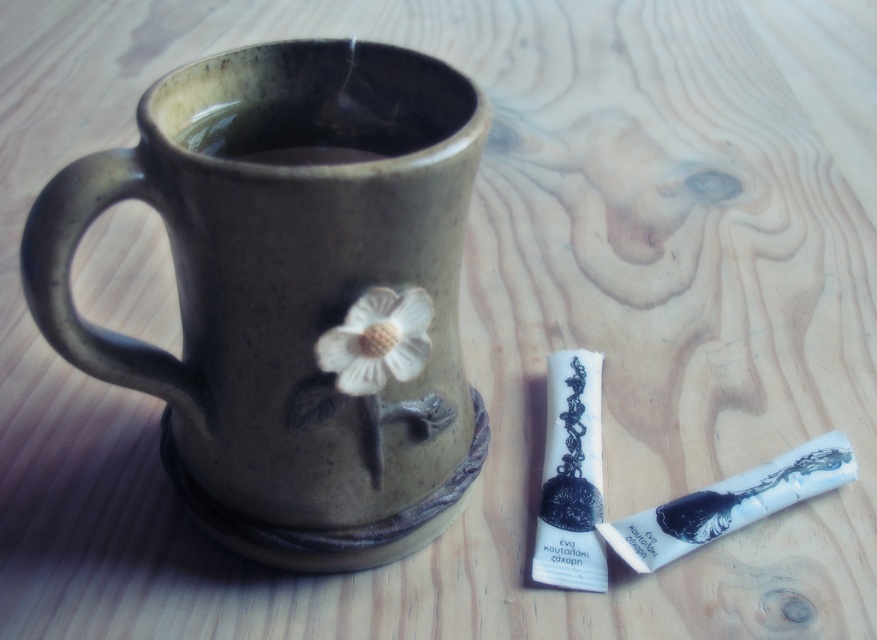
Question: Which object appears closest to the camera in this image?

Choices:
 (A) matte ceramic mug at center
 (B) white matte flower at center

Answer: (A)

Question: Which of these objects is positioned farthest from the white matte flower at center?

Choices:
 (A) matte ceramic mug at center
 (B) brown matte tea at upper center

Answer: (B)

Question: Does brown matte tea at upper center appear under white matte flower at center?

Choices:
 (A) yes
 (B) no

Answer: (B)

Question: Is matte ceramic mug at center in front of brown matte tea at upper center?

Choices:
 (A) no
 (B) yes

Answer: (B)

Question: Does brown matte tea at upper center appear over white matte flower at center?

Choices:
 (A) no
 (B) yes

Answer: (B)

Question: Which object is closer to the camera taking this photo?

Choices:
 (A) matte ceramic mug at center
 (B) brown matte tea at upper center
 (C) white matte flower at center

Answer: (A)